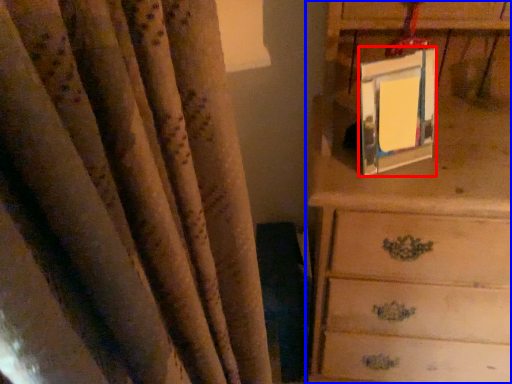
Question: Which point is closer to the camera, picture frame (highlighted by a red box) or chest of drawers (highlighted by a blue box)?

Choices:
 (A) picture frame
 (B) chest of drawers

Answer: (B)